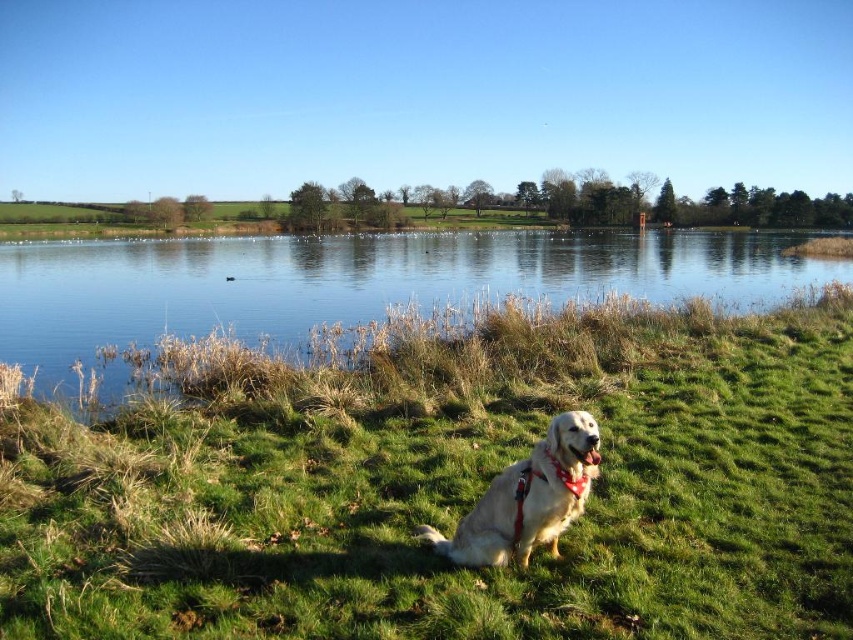
Consider the image. You are standing at the edge of the lake and want to take a photo of both the green grassy at lower center and the clear water at lake center. Which object will appear larger in the photo?

The green grassy at lower center will appear larger in the photo because it is closer to the viewer than the clear water at lake center.

Consider the image. You are standing at the edge of the lake and want to throw a pebble to land as close as possible to the clear water at lake center without hitting the green grassy at lower center. What is the minimum distance you need to throw the pebble?

The minimum distance you need to throw the pebble is 27.53 meters to ensure it lands in the clear water at lake center without hitting the green grassy at lower center.